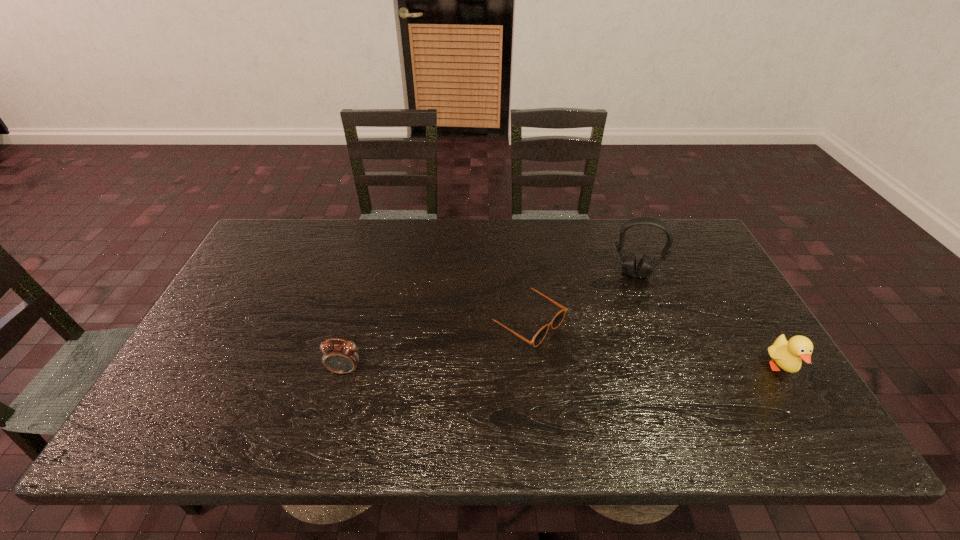
The width and height of the screenshot is (960, 540). In order to click on free spot on the desktop that is between the alarm clock and the duckling and is positioned on the front-facing side of the sunglasses in this screenshot , I will do `click(600, 369)`.

Locate an element on the screen. Image resolution: width=960 pixels, height=540 pixels. vacant space on the desktop that is between the leftmost object and the duckling and is positioned on the front-facing side of the farthest object is located at coordinates (622, 369).